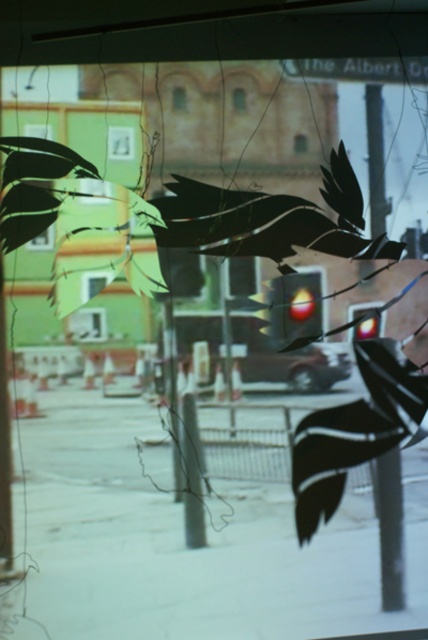
Can you confirm if black glossy bird at center is thinner than black glossy bird at lower right?

No.

Between point (324, 221) and point (312, 426), which one is positioned behind?

Point (324, 221)

Identify the location of black glossy bird at center. (270, 220).